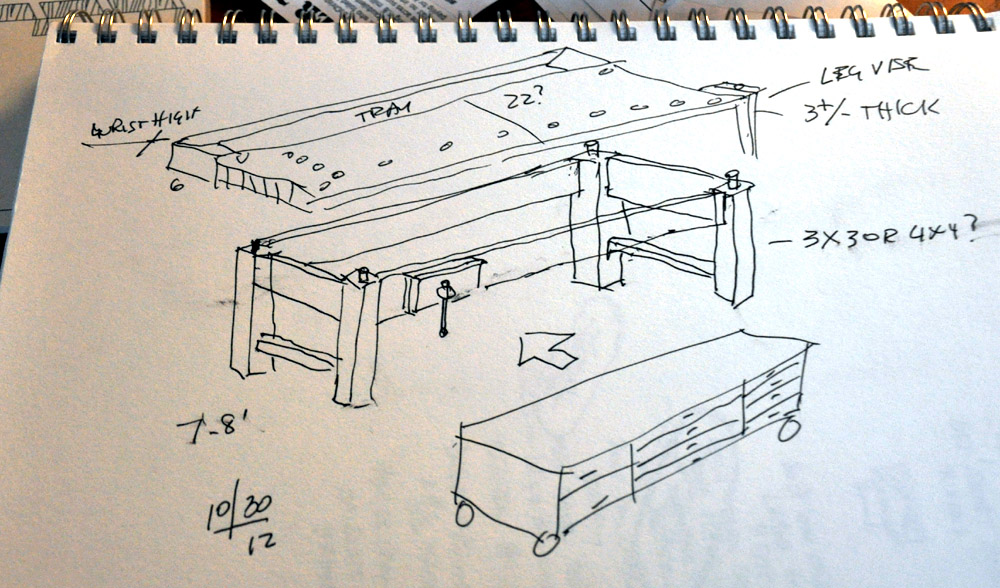
Image resolution: width=1000 pixels, height=588 pixels. I want to click on left furniture legs, so click(x=739, y=266), click(x=613, y=258), click(x=745, y=123).